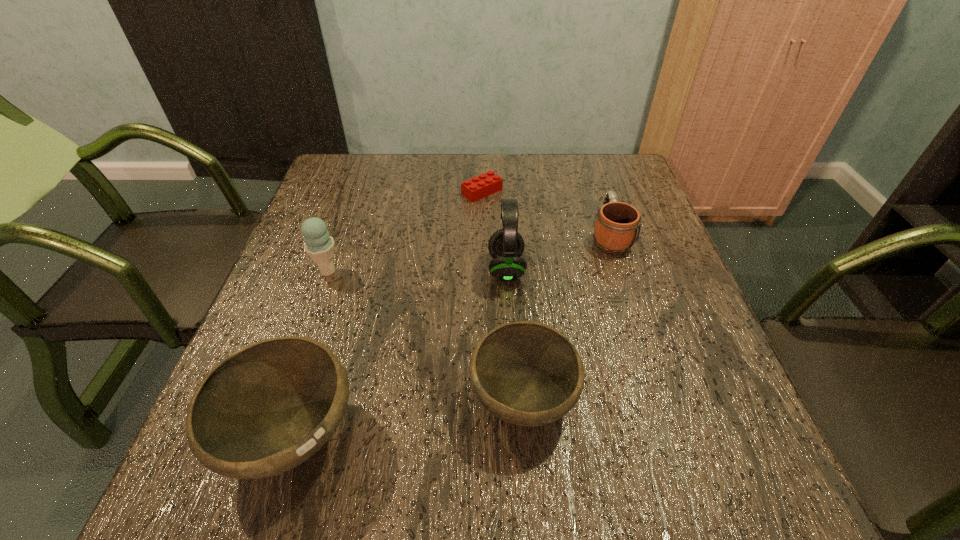
Please point a vacant point for placing a bowl on the right. Please provide its 2D coordinates. Your answer should be formatted as a tuple, i.e. [(x, y)], where the tuple contains the x and y coordinates of a point satisfying the conditions above.

[(726, 367)]